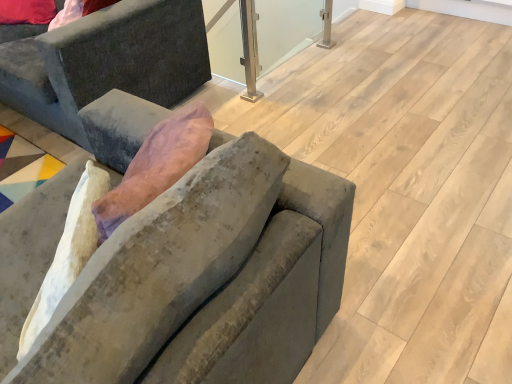
Question: From a real-world perspective, is velvet gray couch at left, the 1th studio couch when ordered from top to bottom, located higher than clear glass window screen at center?

Choices:
 (A) no
 (B) yes

Answer: (B)

Question: Is velvet gray couch at left, acting as the second studio couch starting from the front, outside clear glass window screen at center?

Choices:
 (A) no
 (B) yes

Answer: (B)

Question: Could you tell me if velvet gray couch at left, which ranks as the 2th studio couch in bottom-to-top order, is facing clear glass window screen at center?

Choices:
 (A) no
 (B) yes

Answer: (A)

Question: Does velvet gray couch at left, which appears as the first studio couch when viewed from the back, contain clear glass window screen at center?

Choices:
 (A) yes
 (B) no

Answer: (B)

Question: Would you consider velvet gray couch at left, the 1th studio couch when ordered from top to bottom, to be distant from clear glass window screen at center?

Choices:
 (A) yes
 (B) no

Answer: (A)

Question: From the image's perspective, is velvet gray couch at left, acting as the second studio couch starting from the front, on clear glass window screen at center?

Choices:
 (A) yes
 (B) no

Answer: (A)

Question: From the image's perspective, would you say velvet gray couch at center, positioned as the 2th studio couch in back-to-front order, is shown under velvet gray couch at left, acting as the second studio couch starting from the front?

Choices:
 (A) yes
 (B) no

Answer: (A)

Question: Is velvet gray couch at center, which appears as the first studio couch when viewed from the front, next to velvet gray couch at left, which appears as the first studio couch when viewed from the back, and touching it?

Choices:
 (A) yes
 (B) no

Answer: (B)

Question: From a real-world perspective, is velvet gray couch at center, positioned as the 2th studio couch in back-to-front order, under velvet gray couch at left, the 1th studio couch when ordered from top to bottom?

Choices:
 (A) yes
 (B) no

Answer: (B)

Question: Does velvet gray couch at center, acting as the 1th studio couch starting from the bottom, appear on the right side of velvet gray couch at left, which ranks as the 2th studio couch in bottom-to-top order?

Choices:
 (A) no
 (B) yes

Answer: (B)

Question: Does velvet gray couch at center, positioned as the 2th studio couch in back-to-front order, have a smaller size compared to velvet gray couch at left, acting as the second studio couch starting from the front?

Choices:
 (A) no
 (B) yes

Answer: (B)

Question: Is velvet gray couch at center, positioned as the 2th studio couch in top-to-bottom order, bigger than velvet gray couch at left, which appears as the first studio couch when viewed from the back?

Choices:
 (A) yes
 (B) no

Answer: (B)

Question: From a real-world perspective, is velvet gray couch at left, the 1th studio couch when ordered from top to bottom, located beneath velvet gray couch at center, acting as the 1th studio couch starting from the bottom?

Choices:
 (A) yes
 (B) no

Answer: (A)